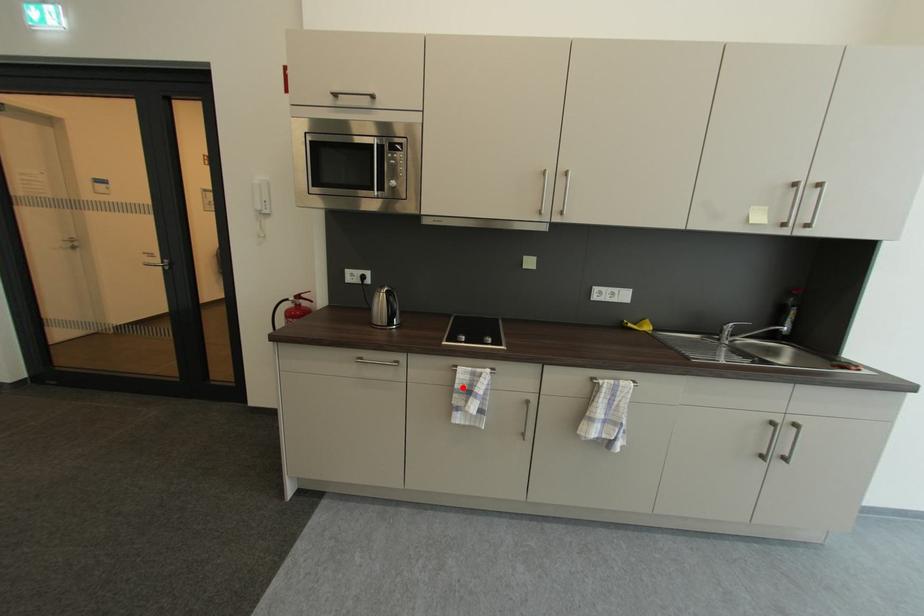
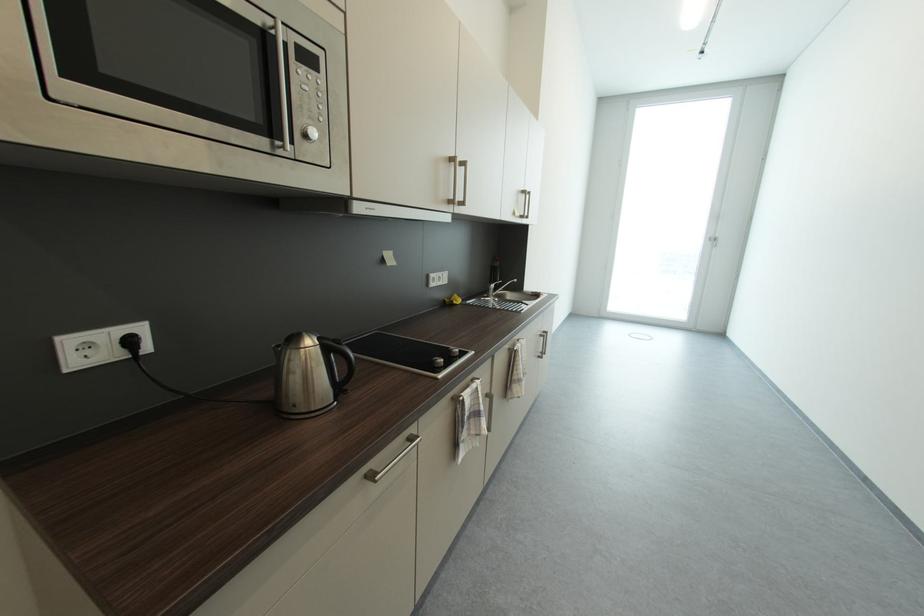
Find the pixel in the second image that matches the highlighted location in the first image.

(472, 419)